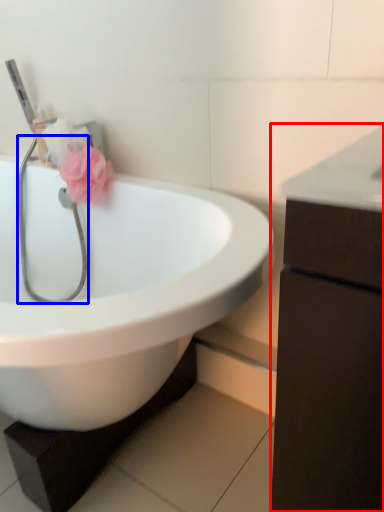
Question: Which of the following is the closest to the observer, bathroom cabinet (highlighted by a red box) or stethoscope (highlighted by a blue box)?

Choices:
 (A) bathroom cabinet
 (B) stethoscope

Answer: (A)